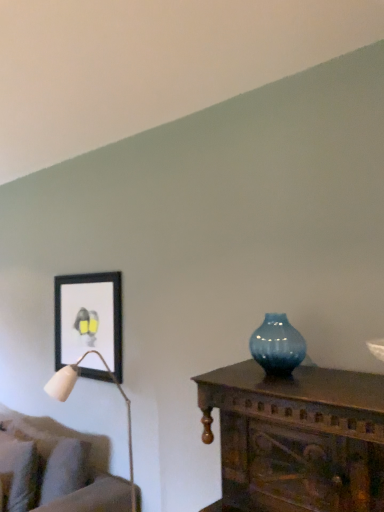
Question: Does point (74, 303) appear closer or farther from the camera than point (266, 347)?

Choices:
 (A) farther
 (B) closer

Answer: (A)

Question: Considering the relative positions of black matte picture frame at upper left and blue glass vase at center in the image provided, is black matte picture frame at upper left to the left or to the right of blue glass vase at center?

Choices:
 (A) left
 (B) right

Answer: (A)

Question: Which object is positioned farthest from the black matte picture frame at upper left?

Choices:
 (A) velvet beige couch at lower left
 (B) blue glass vase at center

Answer: (B)

Question: Which is farther from the black matte picture frame at upper left?

Choices:
 (A) blue glass vase at center
 (B) velvet beige couch at lower left

Answer: (A)